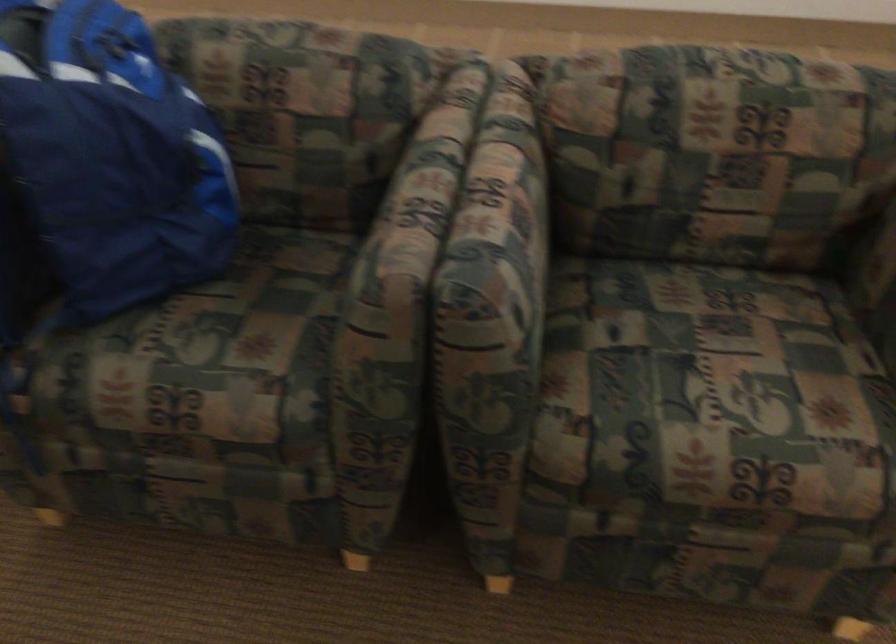
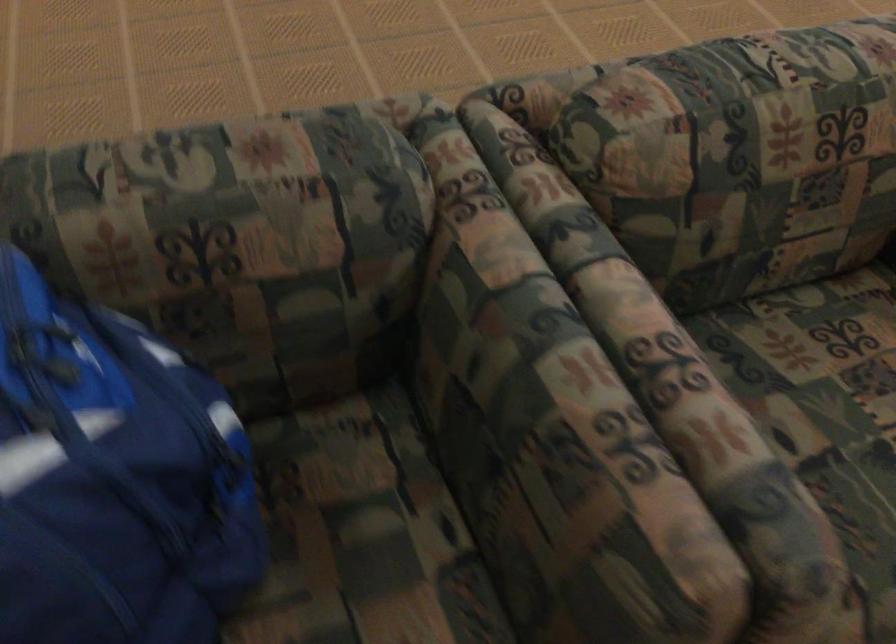
Question: The first image is from the beginning of the video and the second image is from the end. How did the camera likely rotate when shooting the video?

Choices:
 (A) Left
 (B) Right
 (C) Up
 (D) Down

Answer: (B)